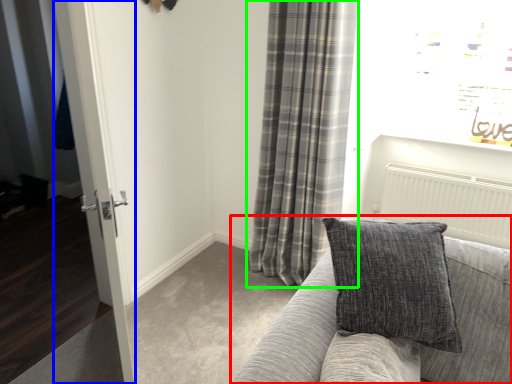
Question: Which object is positioned closest to studio couch (highlighted by a red box)? Select from glass door (highlighted by a blue box) and curtain (highlighted by a green box).

Choices:
 (A) glass door
 (B) curtain

Answer: (A)